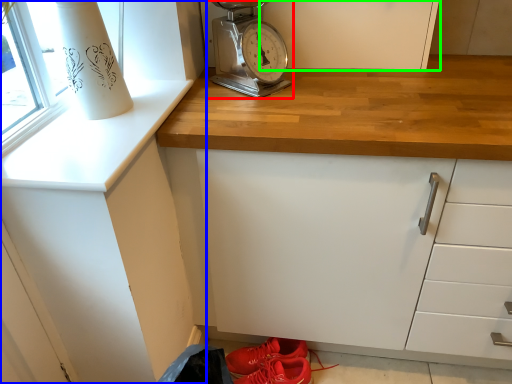
Question: Estimate the real-world distances between objects in this image. Which object is farther from home appliance (highlighted by a red box), cabinetry (highlighted by a blue box) or cabinetry (highlighted by a green box)?

Choices:
 (A) cabinetry
 (B) cabinetry

Answer: (A)